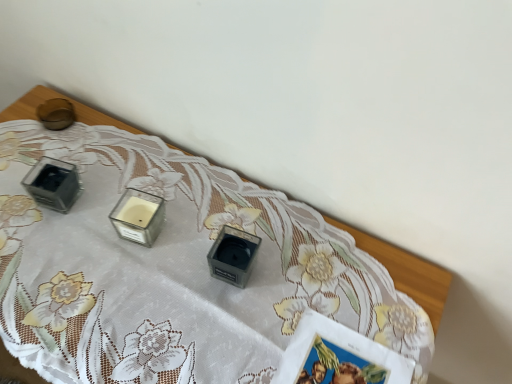
The width and height of the screenshot is (512, 384). Identify the location of free space to the right of clear glass candle at center. (211, 225).